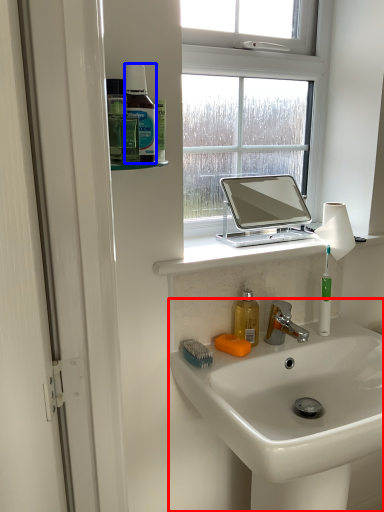
Question: Among these objects, which one is nearest to the camera, sink (highlighted by a red box) or mouthwash (highlighted by a blue box)?

Choices:
 (A) sink
 (B) mouthwash

Answer: (A)